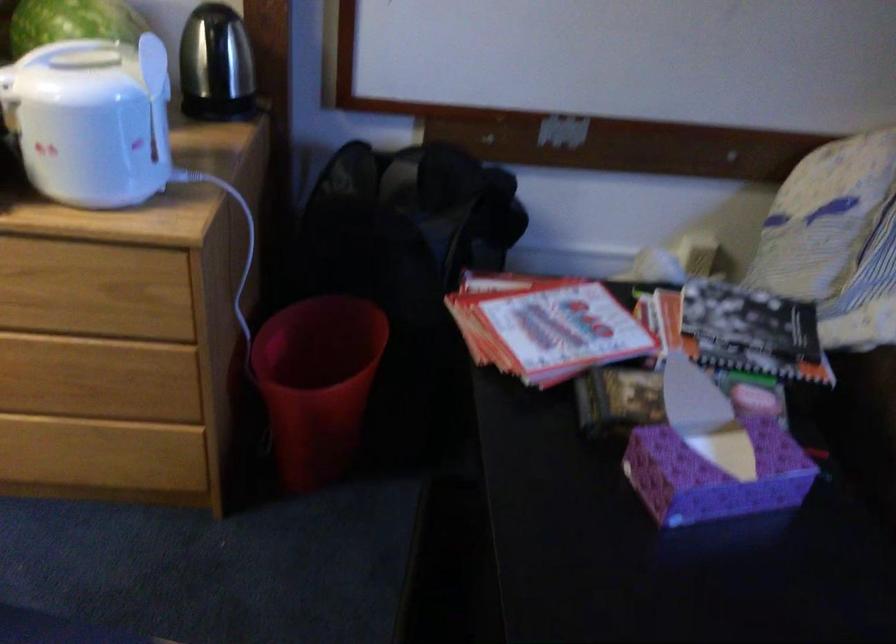
Find the location of a particular element. red trash can is located at coordinates (316, 383).